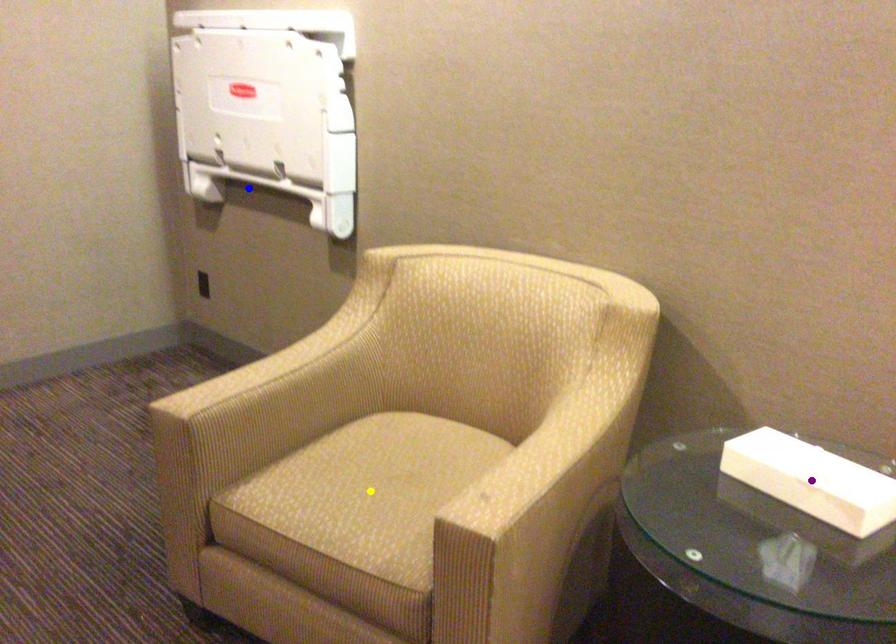
Order these from nearest to farthest:
A) blue point
B) yellow point
C) purple point

purple point, yellow point, blue point